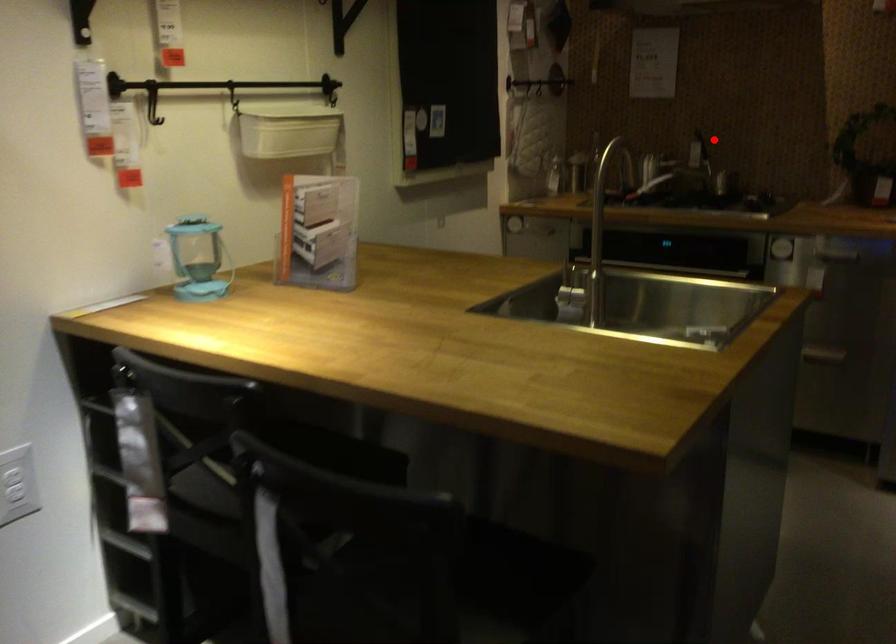
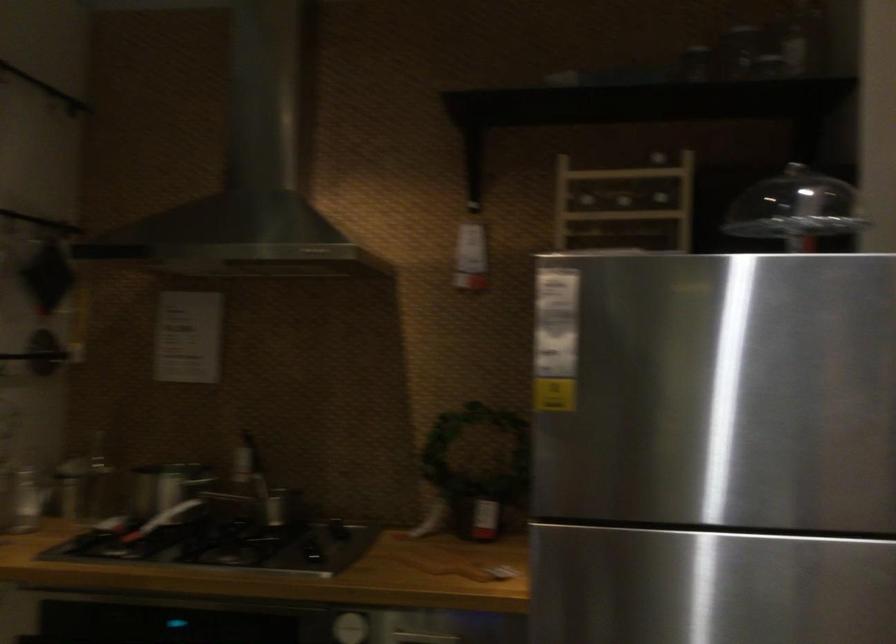
In the second image, find the point that corresponds to the highlighted location in the first image.

(243, 459)